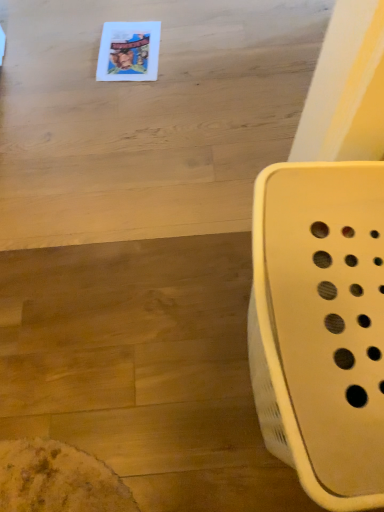
Question: From the image's perspective, is matte wood table at upper center located beneath white plastic laundry basket at right?

Choices:
 (A) yes
 (B) no

Answer: (B)

Question: Could white plastic laundry basket at right be considered to be inside matte wood table at upper center?

Choices:
 (A) no
 (B) yes

Answer: (A)

Question: Considering the relative sizes of matte wood table at upper center and white plastic laundry basket at right in the image provided, is matte wood table at upper center shorter than white plastic laundry basket at right?

Choices:
 (A) yes
 (B) no

Answer: (A)

Question: From a real-world perspective, is matte wood table at upper center below white plastic laundry basket at right?

Choices:
 (A) no
 (B) yes

Answer: (B)

Question: Could you tell me if matte wood table at upper center is facing white plastic laundry basket at right?

Choices:
 (A) yes
 (B) no

Answer: (B)

Question: From the image's perspective, is matte wood table at upper center on top of white plastic laundry basket at right?

Choices:
 (A) yes
 (B) no

Answer: (A)

Question: Considering the relative sizes of white plastic laundry basket at right and matte wood table at upper center in the image provided, is white plastic laundry basket at right taller than matte wood table at upper center?

Choices:
 (A) yes
 (B) no

Answer: (A)

Question: Considering the relative positions of white plastic laundry basket at right and matte wood table at upper center in the image provided, is white plastic laundry basket at right to the right of matte wood table at upper center from the viewer's perspective?

Choices:
 (A) yes
 (B) no

Answer: (A)

Question: Is white plastic laundry basket at right to the left of matte wood table at upper center from the viewer's perspective?

Choices:
 (A) yes
 (B) no

Answer: (B)

Question: Is white plastic laundry basket at right positioned in front of matte wood table at upper center?

Choices:
 (A) no
 (B) yes

Answer: (B)

Question: Considering the relative sizes of white plastic laundry basket at right and matte wood table at upper center in the image provided, is white plastic laundry basket at right smaller than matte wood table at upper center?

Choices:
 (A) no
 (B) yes

Answer: (A)

Question: Is white plastic laundry basket at right facing towards matte wood table at upper center?

Choices:
 (A) yes
 (B) no

Answer: (B)

Question: Looking at the image, does matte wood table at upper center seem bigger or smaller compared to white plastic laundry basket at right?

Choices:
 (A) small
 (B) big

Answer: (A)